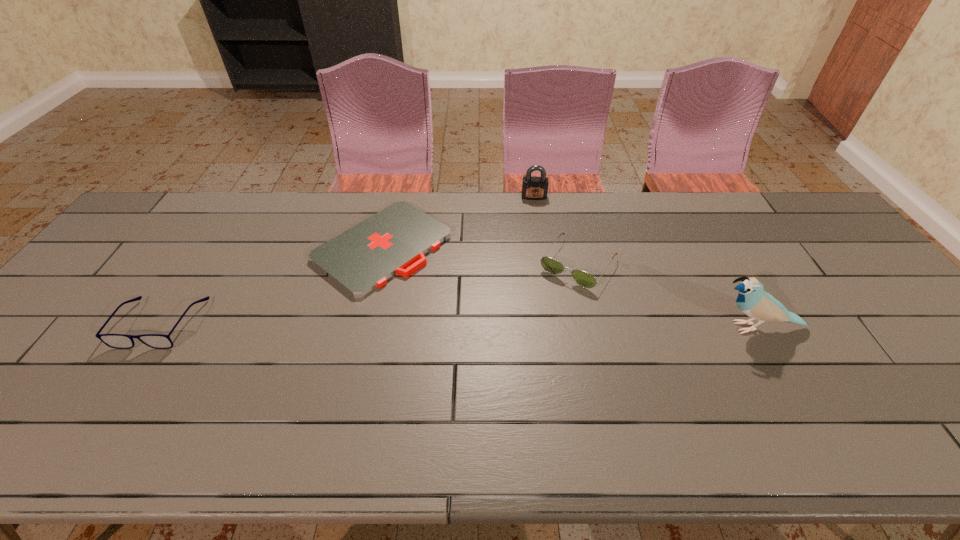
Locate an element on the screen. vacant space located 0.060m at the face of the bird is located at coordinates (684, 327).

Locate an element on the screen. This screenshot has width=960, height=540. free region located at the face of the bird is located at coordinates (597, 327).

Where is `free space located on the front-facing side of the sunglasses`? This screenshot has width=960, height=540. free space located on the front-facing side of the sunglasses is located at coordinates (526, 336).

This screenshot has height=540, width=960. I want to click on free space located 0.390m on the front-facing side of the sunglasses, so click(485, 394).

This screenshot has width=960, height=540. What are the coordinates of `vacant space positioned on the front-facing side of the sunglasses` in the screenshot? It's located at (501, 371).

The height and width of the screenshot is (540, 960). I want to click on vacant space located 0.110m on the front of the farthest object near the keyhole, so click(x=535, y=220).

The image size is (960, 540). In order to click on vacant space located 0.240m on the front of the farthest object near the keyhole in this screenshot , I will do `click(537, 247)`.

Find the location of a particular element. The image size is (960, 540). free space located 0.140m on the front of the farthest object near the keyhole is located at coordinates pos(536,226).

Locate an element on the screen. The image size is (960, 540). free space located on handle side the first-aid kit is located at coordinates (507, 333).

Locate an element on the screen. vacant position located on handle side the first-aid kit is located at coordinates pyautogui.click(x=510, y=335).